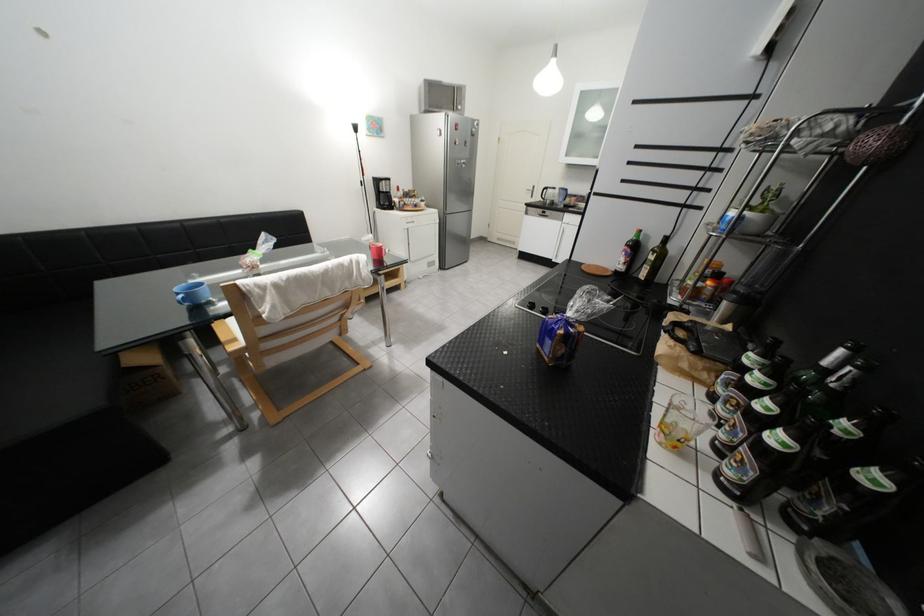
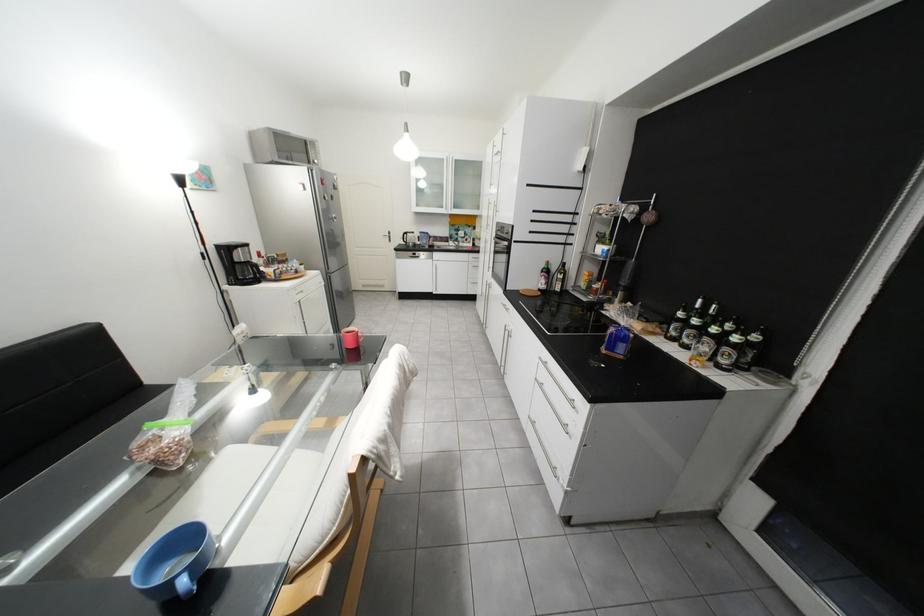
Where in the second image is the point corresponding to (x=545, y=188) from the first image?

(402, 233)